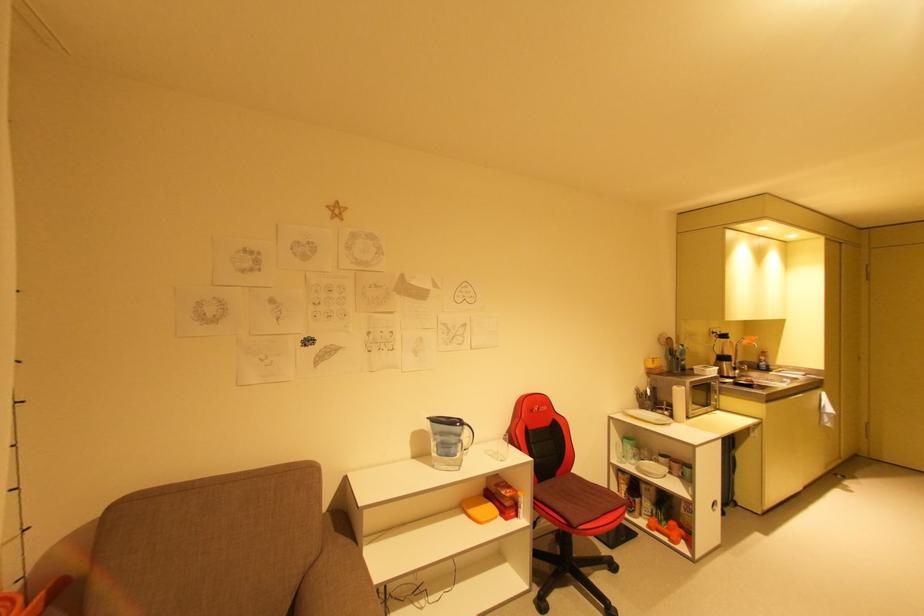
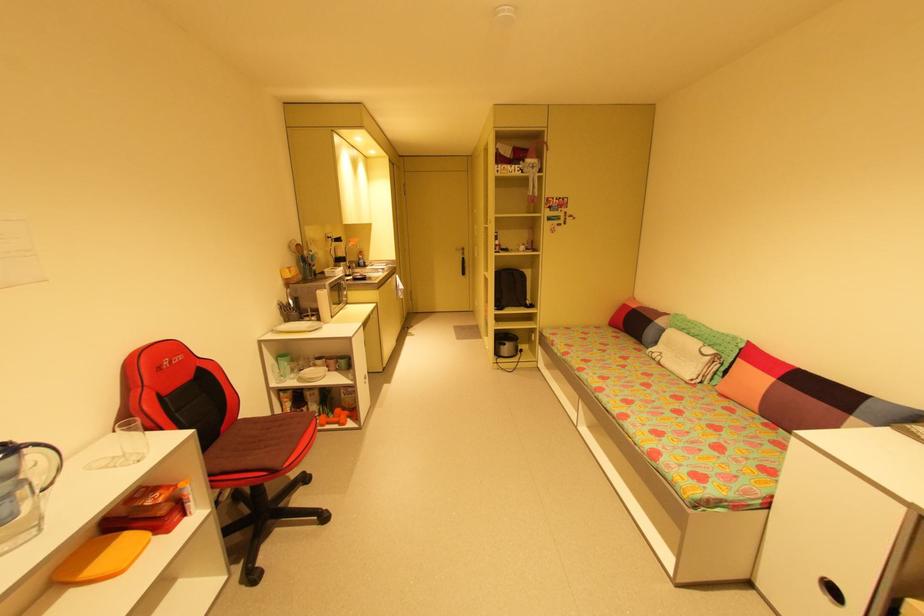
The point at (576, 472) is marked in the first image. Where is the corresponding point in the second image?

(244, 418)